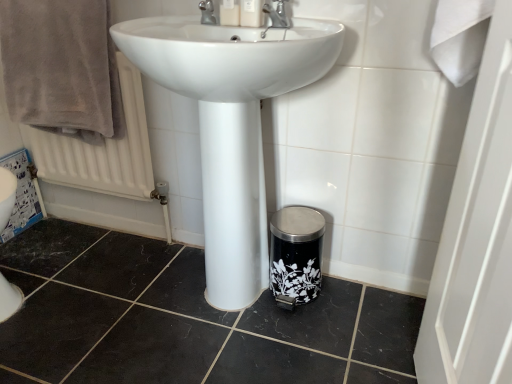
Image resolution: width=512 pixels, height=384 pixels. I want to click on empty space that is in between white glossy sink at center and white textured radiator at upper left, so click(113, 262).